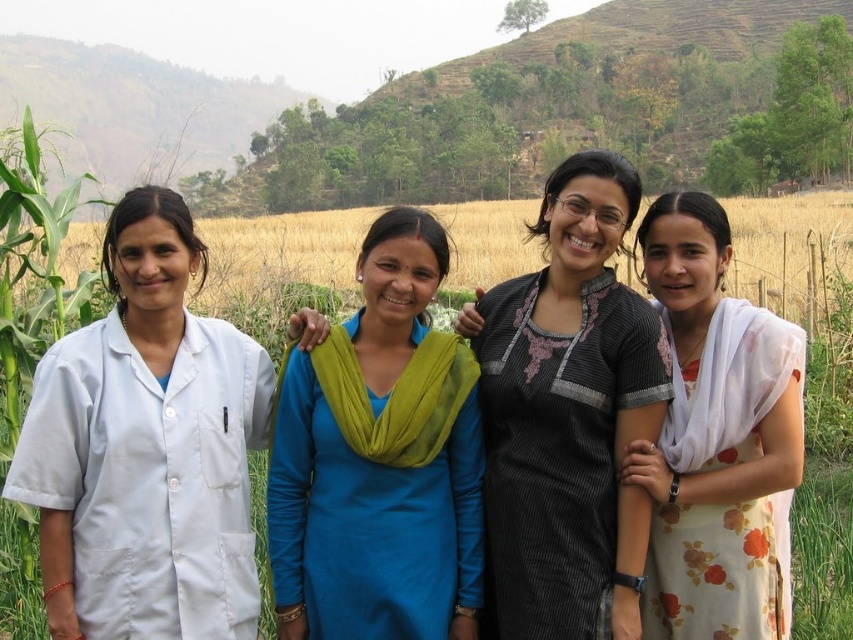
Question: Does white fabric coat at left appear under blue fabric dress at center?

Choices:
 (A) no
 (B) yes

Answer: (A)

Question: Which point appears farthest from the camera in this image?

Choices:
 (A) (779, 202)
 (B) (492, 637)
 (C) (459, 417)
 (D) (79, 355)

Answer: (A)

Question: Can you confirm if blue fabric dress at center is thinner than yellow grassland at center?

Choices:
 (A) yes
 (B) no

Answer: (A)

Question: Which point is farther to the camera?

Choices:
 (A) floral dress at right
 (B) blue fabric dress at center
 (C) yellow grassland at center
 (D) black striped dress at center

Answer: (C)

Question: Based on their relative distances, which object is farther from the black striped dress at center?

Choices:
 (A) white fabric coat at left
 (B) floral dress at right

Answer: (A)

Question: Can you confirm if black striped dress at center is positioned above floral dress at right?

Choices:
 (A) no
 (B) yes

Answer: (B)